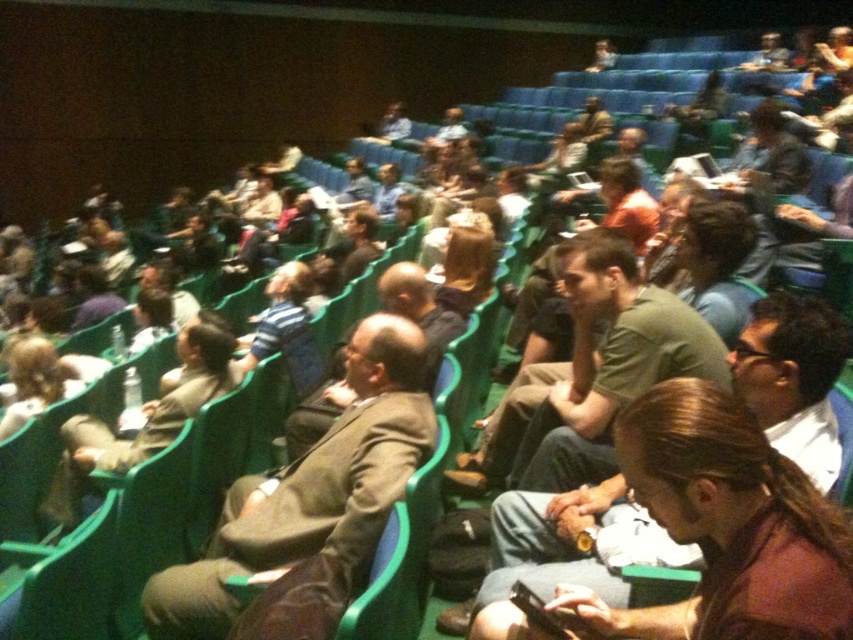
Locate an element on the screen. This screenshot has height=640, width=853. brown leather jacket at center is located at coordinates (312, 490).

Locate an element on the screen. This screenshot has width=853, height=640. brown leather jacket at center is located at coordinates (312, 490).

Find the location of a particular element. Image resolution: width=853 pixels, height=640 pixels. brown leather jacket at center is located at coordinates (312, 490).

Is brown leather jacket at center bigger than green cotton shirt at center?

Yes, brown leather jacket at center is bigger than green cotton shirt at center.

The image size is (853, 640). Describe the element at coordinates (312, 490) in the screenshot. I see `brown leather jacket at center` at that location.

This screenshot has height=640, width=853. In order to click on brown leather jacket at center in this screenshot , I will do `click(312, 490)`.

Which is in front, point (813, 320) or point (486, 449)?

Point (813, 320)

Between green cotton shirt at center and green matte shirt at center, which one is positioned lower?

green cotton shirt at center is below.

What do you see at coordinates (567, 547) in the screenshot?
I see `green cotton shirt at center` at bounding box center [567, 547].

Where is `green cotton shirt at center`? The height and width of the screenshot is (640, 853). green cotton shirt at center is located at coordinates (567, 547).